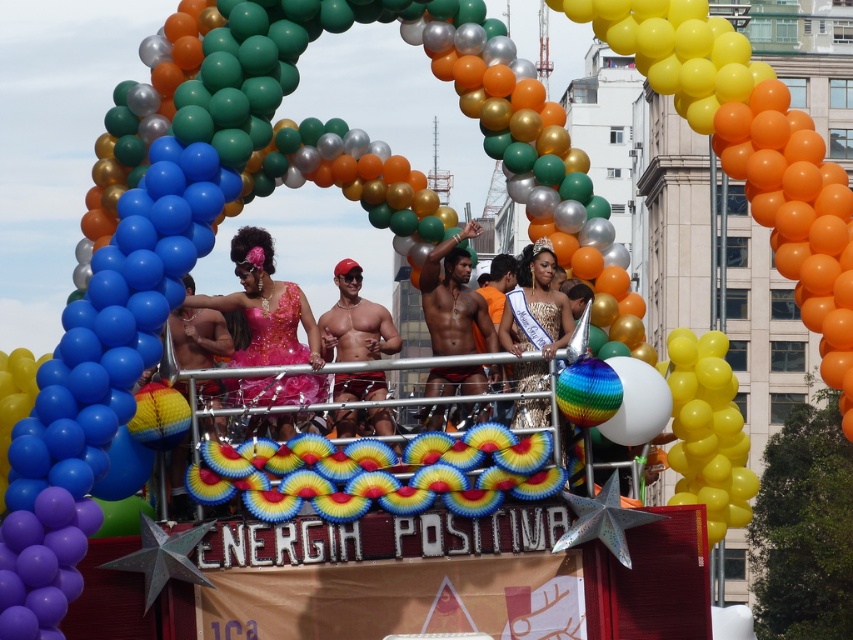
Does sparkly pink dress at center appear under gold sequined dress at center?

Indeed, sparkly pink dress at center is positioned under gold sequined dress at center.

Can you confirm if sparkly pink dress at center is smaller than gold sequined dress at center?

Actually, sparkly pink dress at center might be larger than gold sequined dress at center.

In order to click on sparkly pink dress at center in this screenshot , I will do `click(265, 307)`.

Find the location of a particular element. The width and height of the screenshot is (853, 640). sparkly pink dress at center is located at coordinates (x=265, y=307).

Is point (370, 344) behind point (537, 397)?

Yes, it is behind point (537, 397).

Between point (337, 376) and point (552, 253), which one is positioned in front?

Point (337, 376) is more forward.

Who is more forward, [387,330] or [550,260]?

Point [387,330] is more forward.

The image size is (853, 640). What are the coordinates of `shiny red shorts at center` in the screenshot? It's located at point(355,321).

Can you confirm if shiny metallic shorts at center is taller than shiny red shorts at center?

Yes, shiny metallic shorts at center is taller than shiny red shorts at center.

Does shiny metallic shorts at center have a larger size compared to shiny red shorts at center?

Correct, shiny metallic shorts at center is larger in size than shiny red shorts at center.

Describe the element at coordinates (453, 298) in the screenshot. Image resolution: width=853 pixels, height=640 pixels. I see `shiny metallic shorts at center` at that location.

Where is `shiny metallic shorts at center`? shiny metallic shorts at center is located at coordinates (453, 298).